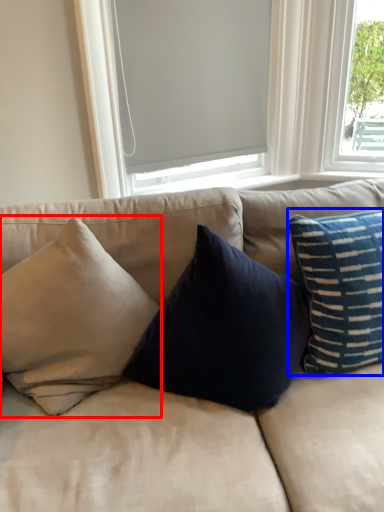
Question: Which object appears closest to the camera in this image, pillow (highlighted by a red box) or pillow (highlighted by a blue box)?

Choices:
 (A) pillow
 (B) pillow

Answer: (A)